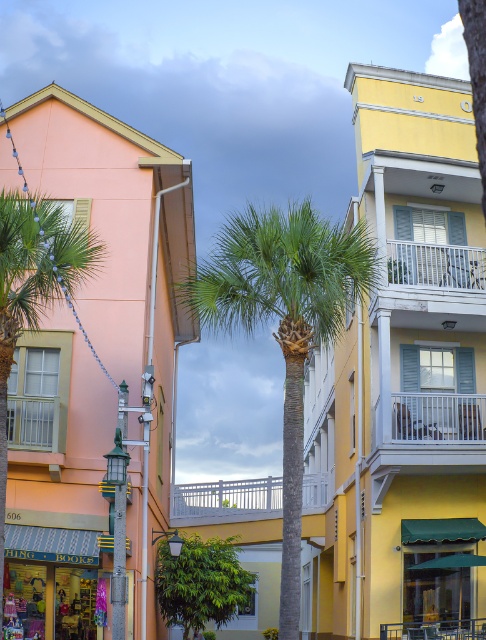
You are a customer standing in front of the matte pink building at left and want to take a photo of the green leafy palm tree at center. Can you see the palm tree clearly from your current position?

The green leafy palm tree at center is behind the matte pink building at left, so you cannot see it clearly from your current position in front of the matte pink building at left.

You are standing in the middle of the street looking at the two buildings. There are two points marked on the buildings. The first point is at coordinates point (x=58, y=99) and the second is at point (x=294, y=518). Which point appears closer to you?

Point (x=58, y=99) is further to the camera than point (x=294, y=518). Therefore, point (x=294, y=518) appears closer to you.